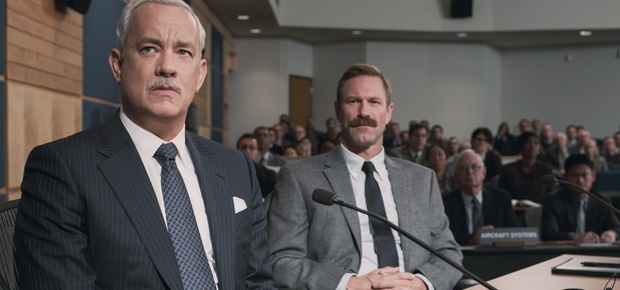
Locate an element on the screen. Image resolution: width=620 pixels, height=290 pixels. chair is located at coordinates (4, 234).